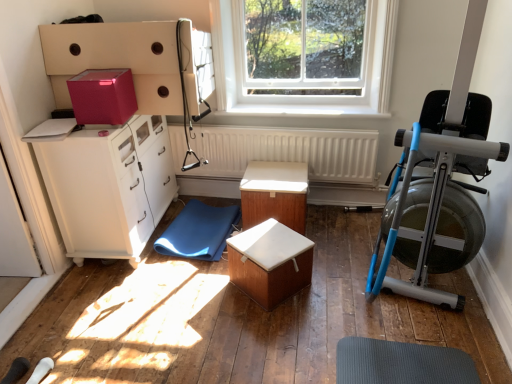
You are a GUI agent. You are given a task and a screenshot of the screen. Output one action in this format:
    pyautogui.click(x=<x>, y=<y>)
    Task: Click on the unoccupied region to the right of wooden box at center, the first table viewed from the front
    The width and height of the screenshot is (512, 384).
    Given the screenshot: What is the action you would take?
    pyautogui.click(x=331, y=289)